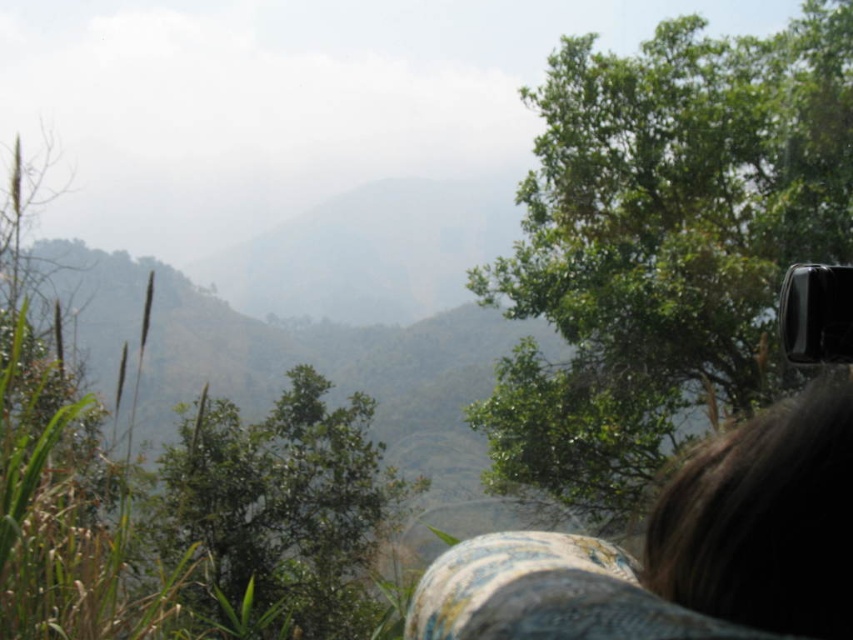
Who is more distant from viewer, (602,182) or (279,520)?

The point (602,182) is more distant.

Is green leafy tree at upper right positioned at the back of green leafy tree at center?

Yes, it is behind green leafy tree at center.

Describe the element at coordinates (663, 244) in the screenshot. I see `green leafy tree at upper right` at that location.

Locate an element on the screen. green leafy tree at upper right is located at coordinates (663, 244).